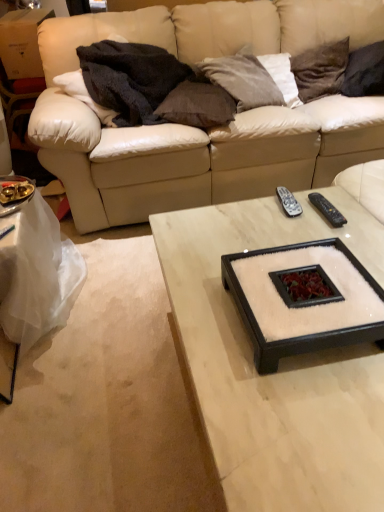
The image size is (384, 512). Identify the location of vacant space situated on the left part of black plastic remote control at right, marked as the second remote control in a left-to-right arrangement. (280, 220).